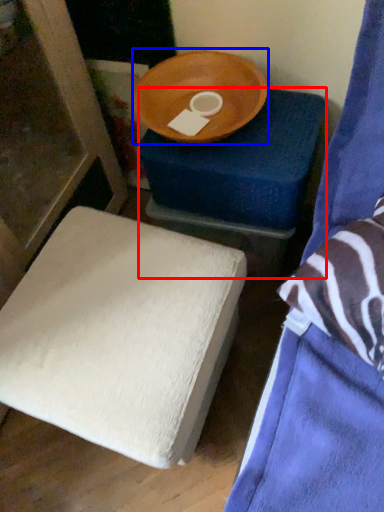
Question: Which object is closer to the camera taking this photo, furniture (highlighted by a red box) or round table (highlighted by a blue box)?

Choices:
 (A) furniture
 (B) round table

Answer: (B)